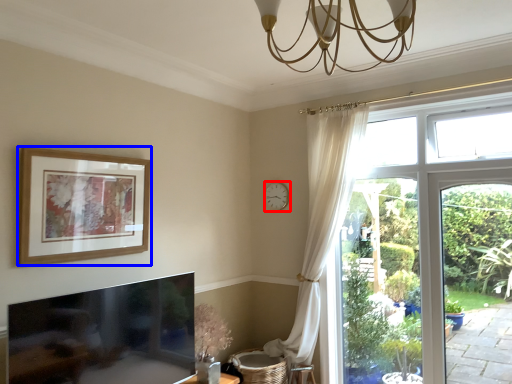
Question: Which object is closer to the camera taking this photo, clock (highlighted by a red box) or picture frame (highlighted by a blue box)?

Choices:
 (A) clock
 (B) picture frame

Answer: (B)